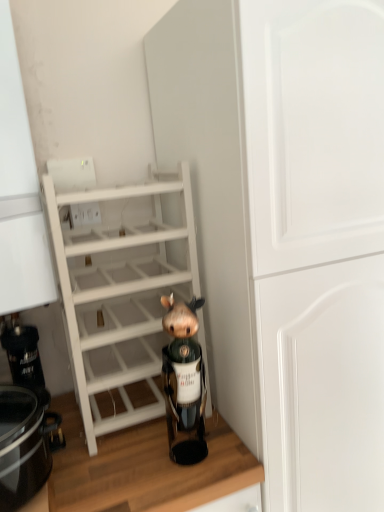
Find the location of `free location above wooden at lower center (from a real-world perspective)`. free location above wooden at lower center (from a real-world perspective) is located at coordinates (118, 440).